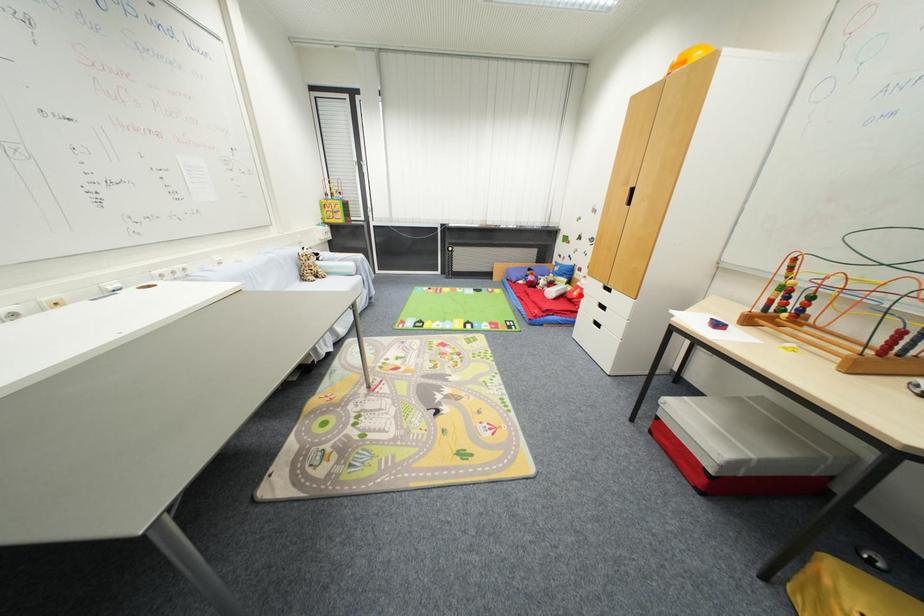
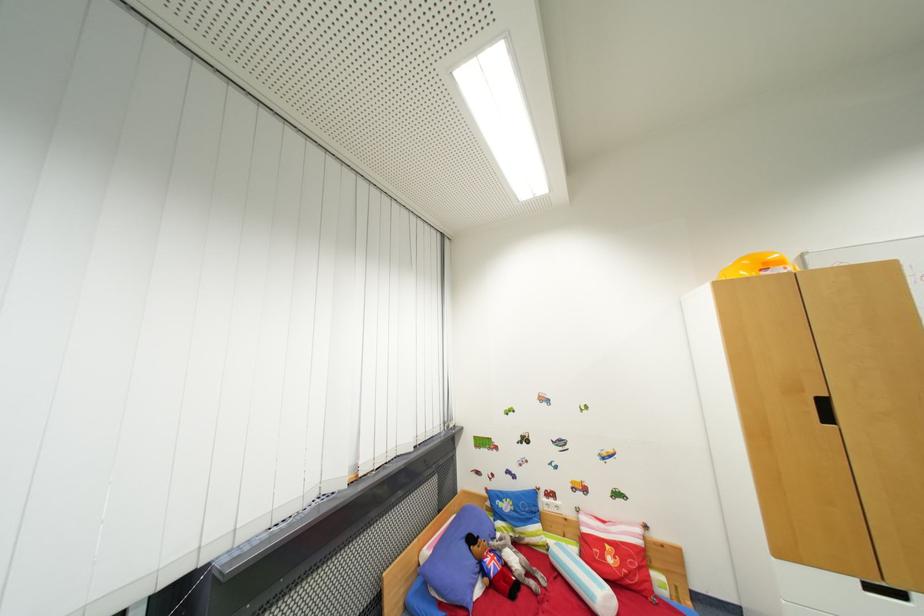
Question: I am providing you with two images of the same scene from different viewpoints. Image1 has a red point marked. In image2, the corresponding 3D location appears at what relative position? Reply with the corresponding letter.

Choices:
 (A) Closer
 (B) Farther

Answer: (B)